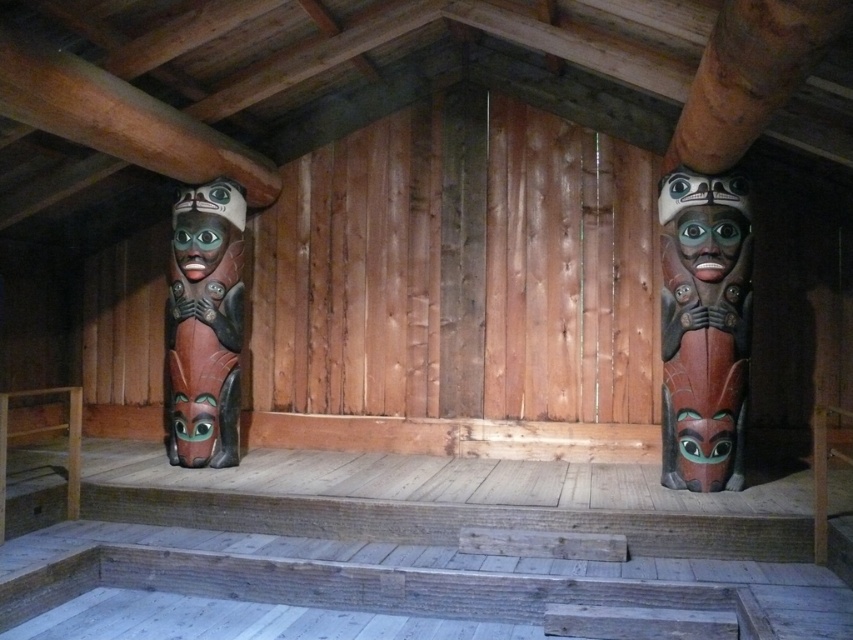
Question: Which of the following is the closest to the observer?

Choices:
 (A) (230, 433)
 (B) (720, 438)

Answer: (B)

Question: Is polished wood totem pole at right to the left of polished wood totem pole at center from the viewer's perspective?

Choices:
 (A) no
 (B) yes

Answer: (A)

Question: Does polished wood totem pole at right have a larger size compared to polished wood totem pole at center?

Choices:
 (A) yes
 (B) no

Answer: (A)

Question: Which point is closer to the camera?

Choices:
 (A) polished wood totem pole at center
 (B) polished wood totem pole at right

Answer: (B)

Question: Which point is farther from the camera taking this photo?

Choices:
 (A) (223, 227)
 (B) (711, 186)

Answer: (A)

Question: Can you confirm if polished wood totem pole at right is bigger than polished wood totem pole at center?

Choices:
 (A) yes
 (B) no

Answer: (A)